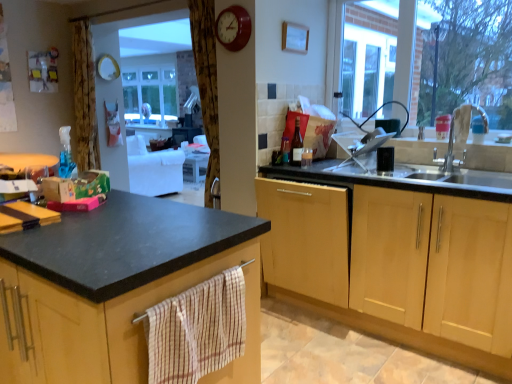
In order to face white matte tap at right, should I rotate leftwards or rightwards?

You should rotate right by 26.056 degrees.

You are a GUI agent. You are given a task and a screenshot of the screen. Output one action in this format:
    pyautogui.click(x=<x>, y=<y>)
    Task: Click on the white matte tap at right
    
    Given the screenshot: What is the action you would take?
    pyautogui.click(x=460, y=134)

Find the location of `matte red clock at upper center`. matte red clock at upper center is located at coordinates (233, 28).

From a real-world perspective, is matte red clock at upper center on top of light wood cabinet at center, the first cabinetry from the right?

Indeed, from a real-world perspective, matte red clock at upper center stands above light wood cabinet at center, the first cabinetry from the right.

How different are the orientations of matte red clock at upper center and light wood cabinet at center, the 2th cabinetry in the left-to-right sequence, in degrees?

There is a 0.201-degree angle between the facing directions of matte red clock at upper center and light wood cabinet at center, the 2th cabinetry in the left-to-right sequence.

Is matte red clock at upper center facing towards light wood cabinet at center, the 2th cabinetry in the left-to-right sequence?

No, matte red clock at upper center is not aimed at light wood cabinet at center, the 2th cabinetry in the left-to-right sequence.

Which object is positioned more to the right, matte red clock at upper center or light wood cabinet at center, the 2th cabinetry in the left-to-right sequence?

Positioned to the right is light wood cabinet at center, the 2th cabinetry in the left-to-right sequence.

From a real-world perspective, is matte red clock at upper center positioned under matte black countertop at left, the 1th cabinetry in the left-to-right sequence, based on gravity?

No, from a real-world perspective, matte red clock at upper center is not beneath matte black countertop at left, the 1th cabinetry in the left-to-right sequence.

You are a GUI agent. You are given a task and a screenshot of the screen. Output one action in this format:
    pyautogui.click(x=<x>, y=<y>)
    Task: Click on the 2nd cabinetry in front of the matte red clock at upper center
    
    Given the screenshot: What is the action you would take?
    pyautogui.click(x=113, y=326)

Is matte red clock at upper center not within matte black countertop at left, the 2th cabinetry viewed from the right?

matte red clock at upper center is positioned outside matte black countertop at left, the 2th cabinetry viewed from the right.

Based on the photo, is matte red clock at upper center at the left side of matte black countertop at left, the 1th cabinetry in the left-to-right sequence?

Incorrect, matte red clock at upper center is not on the left side of matte black countertop at left, the 1th cabinetry in the left-to-right sequence.

Is point (215, 102) farther from viewer compared to point (446, 144)?

Yes, it is behind point (446, 144).

From the image's perspective, is brown textured curtain at upper center positioned above or below metallic sink at right?

brown textured curtain at upper center is situated higher than metallic sink at right in the image.

Is brown textured curtain at upper center completely or partially outside of metallic sink at right?

Absolutely, brown textured curtain at upper center is external to metallic sink at right.

Is brown textured curtain at upper center facing towards metallic sink at right?

No, brown textured curtain at upper center is not facing towards metallic sink at right.

Is metallic sink at right situated inside brown textured curtain at upper center or outside?

metallic sink at right exists outside the volume of brown textured curtain at upper center.

Is metallic sink at right next to brown textured curtain at upper center and touching it?

No.

From the image's perspective, which one is positioned higher, metallic sink at right or brown textured curtain at upper center?

brown textured curtain at upper center appears higher in the image.

Is matte black countertop at left, the 1th cabinetry in the left-to-right sequence, facing away from matte red clock at upper center?

matte black countertop at left, the 1th cabinetry in the left-to-right sequence, is not turned away from matte red clock at upper center.

How different are the orientations of matte black countertop at left, the 2th cabinetry viewed from the right, and matte red clock at upper center in degrees?

matte black countertop at left, the 2th cabinetry viewed from the right, and matte red clock at upper center are facing 179 degrees away from each other.

Does matte black countertop at left, the 1th cabinetry in the left-to-right sequence, have a greater width compared to matte red clock at upper center?

Yes, matte black countertop at left, the 1th cabinetry in the left-to-right sequence, is wider than matte red clock at upper center.

From a real-world perspective, is brown textured curtain at upper center above or below white matte tap at right?

In terms of real-world spatial position, brown textured curtain at upper center is above white matte tap at right.

Where is `curtain on the left side of white matte tap at right`? curtain on the left side of white matte tap at right is located at coordinates (206, 82).

Is brown textured curtain at upper center to the left of white matte tap at right from the viewer's perspective?

Yes, brown textured curtain at upper center is to the left of white matte tap at right.

Is brown textured curtain at upper center not within white matte tap at right?

Absolutely, brown textured curtain at upper center is external to white matte tap at right.

Where is `cabinetry that is the 1st one when counting downward from the metallic sink at right (from the image's perspective)`? This screenshot has height=384, width=512. cabinetry that is the 1st one when counting downward from the metallic sink at right (from the image's perspective) is located at coordinates (358, 262).

From the image's perspective, would you say metallic sink at right is positioned over light wood cabinet at center, the 2th cabinetry in the left-to-right sequence?

Correct, metallic sink at right appears higher than light wood cabinet at center, the 2th cabinetry in the left-to-right sequence, in the image.

Based on their positions, is metallic sink at right located to the left or right of light wood cabinet at center, the 2th cabinetry in the left-to-right sequence?

Clearly, metallic sink at right is on the right of light wood cabinet at center, the 2th cabinetry in the left-to-right sequence, in the image.

The height and width of the screenshot is (384, 512). I want to click on clock lying behind the light wood cabinet at center, the 2th cabinetry in the left-to-right sequence, so click(x=233, y=28).

This screenshot has height=384, width=512. In order to click on the 1st cabinetry directly beneath the matte red clock at upper center (from a real-world perspective) in this screenshot , I will do `click(113, 326)`.

Estimate the real-world distances between objects in this image. Which object is further from metallic sink at right, matte red clock at upper center or brown textured curtain at upper center?

brown textured curtain at upper center lies further to metallic sink at right than the other object.

When comparing their distances from brown textured curtain at upper center, does matte red clock at upper center or metallic sink at right seem further?

metallic sink at right.

Looking at the image, which one is located closer to brown textured curtain at upper center, white matte tap at right or matte red clock at upper center?

matte red clock at upper center is closer to brown textured curtain at upper center.

Looking at the image, which one is located further to matte black countertop at left, the 1th cabinetry in the left-to-right sequence, light wood cabinet at center, the first cabinetry from the right, or brown textured curtain at upper center?

brown textured curtain at upper center is positioned further to the anchor matte black countertop at left, the 1th cabinetry in the left-to-right sequence.

Considering their positions, is light wood cabinet at center, the first cabinetry from the right, positioned closer to matte black countertop at left, the 1th cabinetry in the left-to-right sequence, than metallic sink at right?

The object closer to matte black countertop at left, the 1th cabinetry in the left-to-right sequence, is light wood cabinet at center, the first cabinetry from the right.

When comparing their distances from white matte tap at right, does metallic sink at right or light wood cabinet at center, the 2th cabinetry in the left-to-right sequence, seem further?

Based on the image, light wood cabinet at center, the 2th cabinetry in the left-to-right sequence, appears to be further to white matte tap at right.

Consider the image. From the image, which object appears to be farther from matte black countertop at left, the 1th cabinetry in the left-to-right sequence, brown textured curtain at upper center or matte red clock at upper center?

The object further to matte black countertop at left, the 1th cabinetry in the left-to-right sequence, is brown textured curtain at upper center.

Which object lies further to the anchor point matte red clock at upper center, matte black countertop at left, the 2th cabinetry viewed from the right, or metallic sink at right?

matte black countertop at left, the 2th cabinetry viewed from the right, is further to matte red clock at upper center.

I want to click on cabinetry between brown textured curtain at upper center and white matte tap at right, so click(x=358, y=262).

At what (x,y) coordinates should I click in order to perform the action: click on cabinetry between matte black countertop at left, the 1th cabinetry in the left-to-right sequence, and metallic sink at right from left to right. Please return your answer as a coordinate pair (x, y). The height and width of the screenshot is (384, 512). Looking at the image, I should click on (358, 262).

Identify the location of clock located between matte black countertop at left, the 2th cabinetry viewed from the right, and brown textured curtain at upper center in the depth direction. (233, 28).

Image resolution: width=512 pixels, height=384 pixels. I want to click on sink located between matte black countertop at left, the 1th cabinetry in the left-to-right sequence, and white matte tap at right in the left-right direction, so click(x=485, y=156).